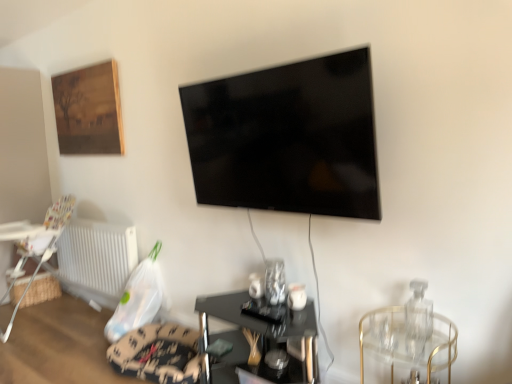
What are the coordinates of `free spot to the right of woven wood table at left, acting as the 1th table starting from the left` in the screenshot? It's located at (56, 305).